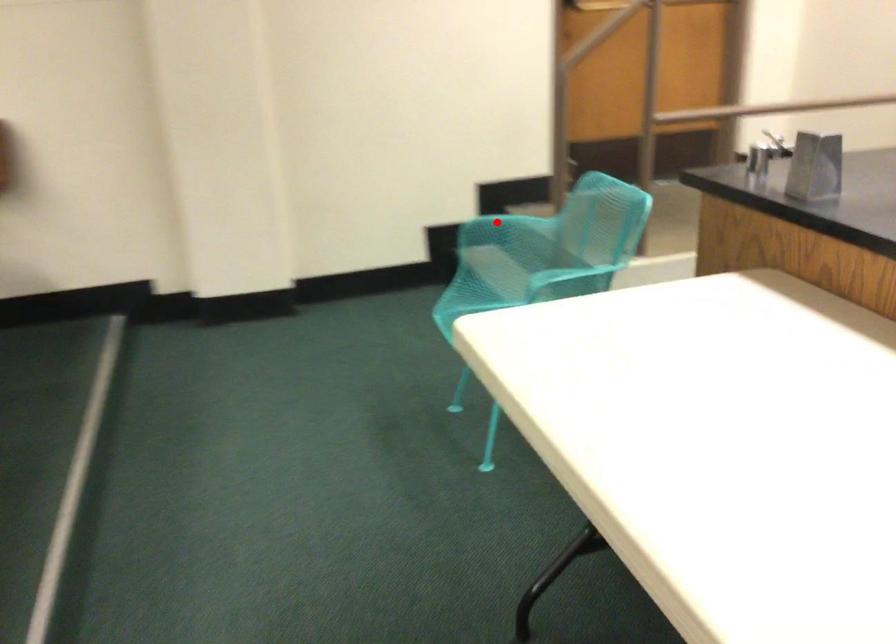
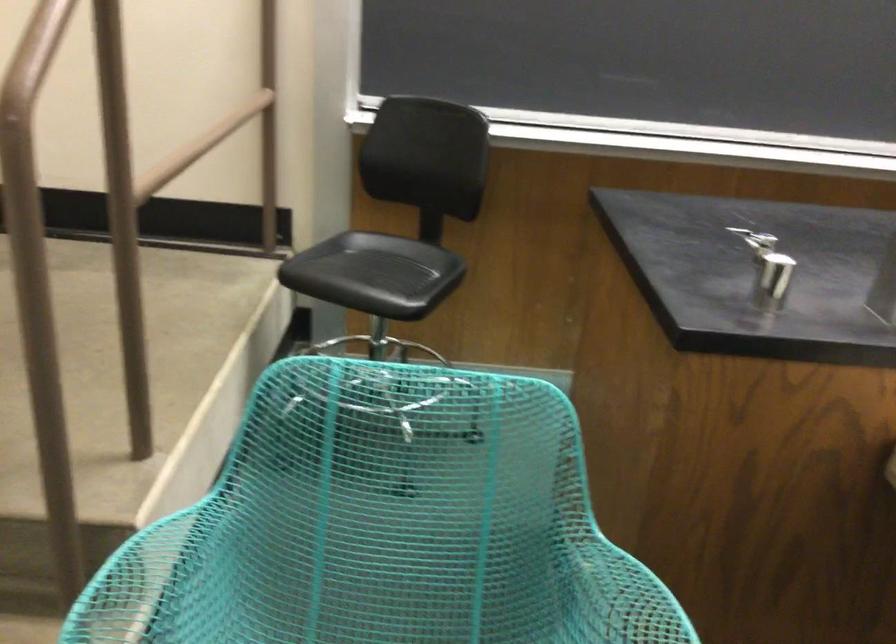
In the second image, find the point that corresponds to the highlighted location in the first image.

(150, 582)